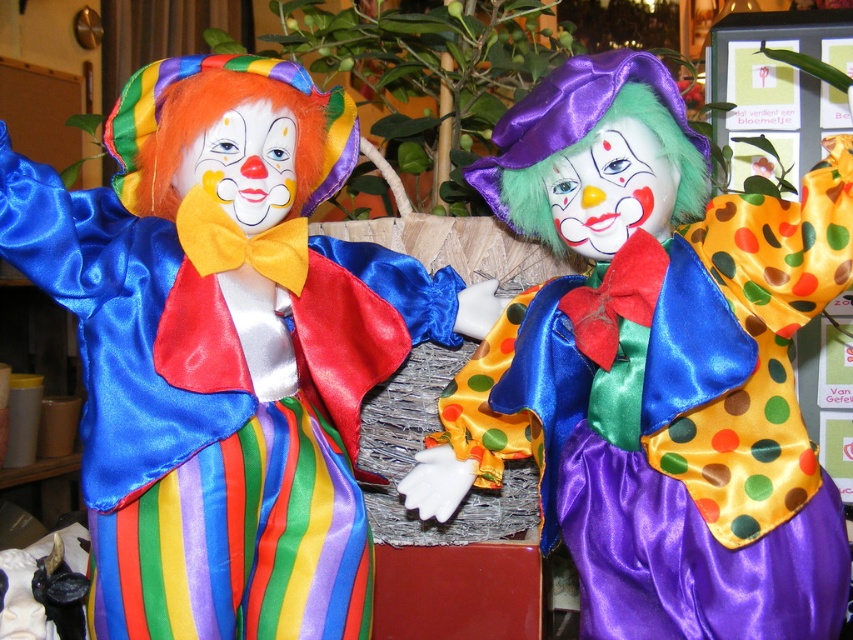
Which is above, satin clown at left or polka dot satin clown at center?

satin clown at left is higher up.

Can you confirm if satin clown at left is thinner than polka dot satin clown at center?

No, satin clown at left is not thinner than polka dot satin clown at center.

What do you see at coordinates (225, 349) in the screenshot? Image resolution: width=853 pixels, height=640 pixels. I see `satin clown at left` at bounding box center [225, 349].

Where is `satin clown at left`? The image size is (853, 640). satin clown at left is located at coordinates (225, 349).